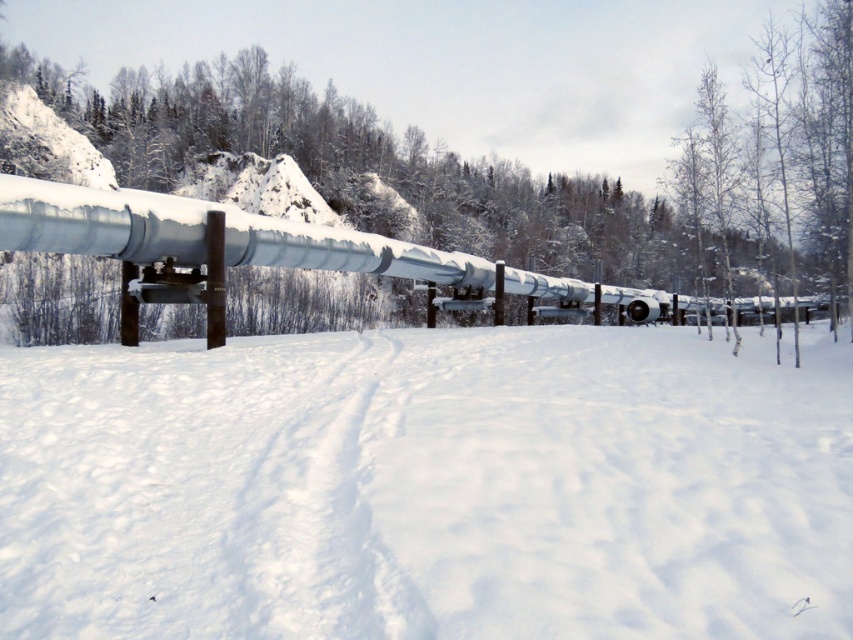
You are an engineer assessing the space between the smooth bark tree at center and the sleek metallic pipeline at center. Can you determine if the tree is wider than the pipeline?

The smooth bark tree at center has a width larger than the sleek metallic pipeline at center, so yes, the tree is wider than the pipeline.

You are standing at the point marked as point (426, 486) in the snowy landscape. What is the surface you are currently standing on?

The point (426, 486) is on white fluffy snow at center, so you are standing on white fluffy snow at center.

You are an environmental scientist assessing the snow coverage in the area. You observe the white fluffy snow at center and the smooth bark tree at center. Which of these two has a greater thickness in the depicted scene?

The white fluffy snow at center is thinner than the smooth bark tree at center, so the smooth bark tree at center has greater thickness.